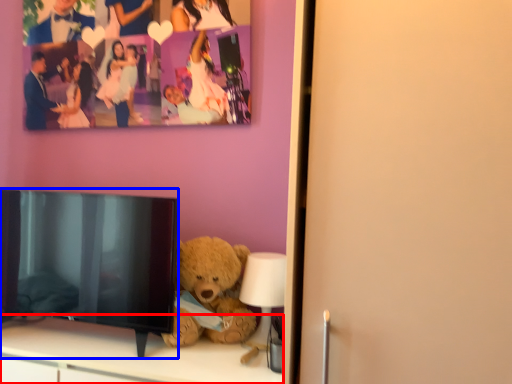
Question: Among these objects, which one is farthest to the camera, furniture (highlighted by a red box) or television (highlighted by a blue box)?

Choices:
 (A) furniture
 (B) television

Answer: (B)